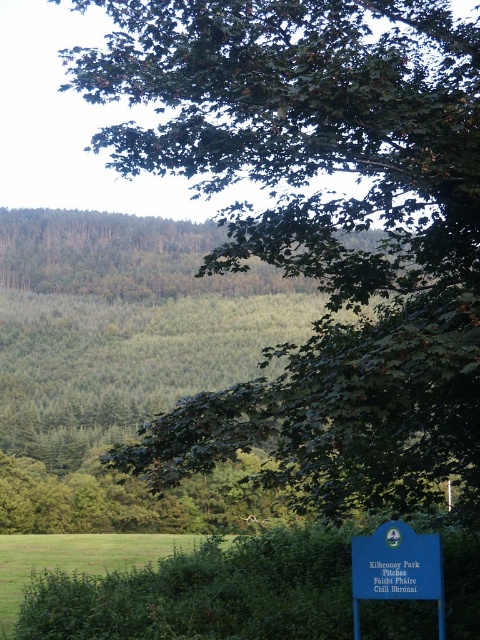
You are a gardener who needs to place a 3 meter long fence panel between the green leafy hedge at lower center and the blue plastic sign at lower right. Can you fit the fence panel between them?

The distance between the green leafy hedge at lower center and the blue plastic sign at lower right is 3.13 meters, so the 3 meter long fence panel can fit between them since it is shorter than the available space.

You are a park visitor who wants to take a photo of the blue plastic sign at lower right without the green leafy hedge at lower center blocking it. Which direction should you move to achieve this?

The green leafy hedge at lower center is larger in size than the blue plastic sign at lower right. To avoid the hedge blocking the sign, move to the right side of the hedge so that the smaller sign becomes visible beyond the hedge.

You are a hiker who wants to place a small picnic basket between the green leafy hedge at lower center and the blue plastic sign at lower right. Based on their positions, which object should you use as a reference point to ensure the basket is placed correctly?

The green leafy hedge at lower center is to the left of the blue plastic sign at lower right, so you should use the blue plastic sign at lower right as the reference point to place the basket to its left side.